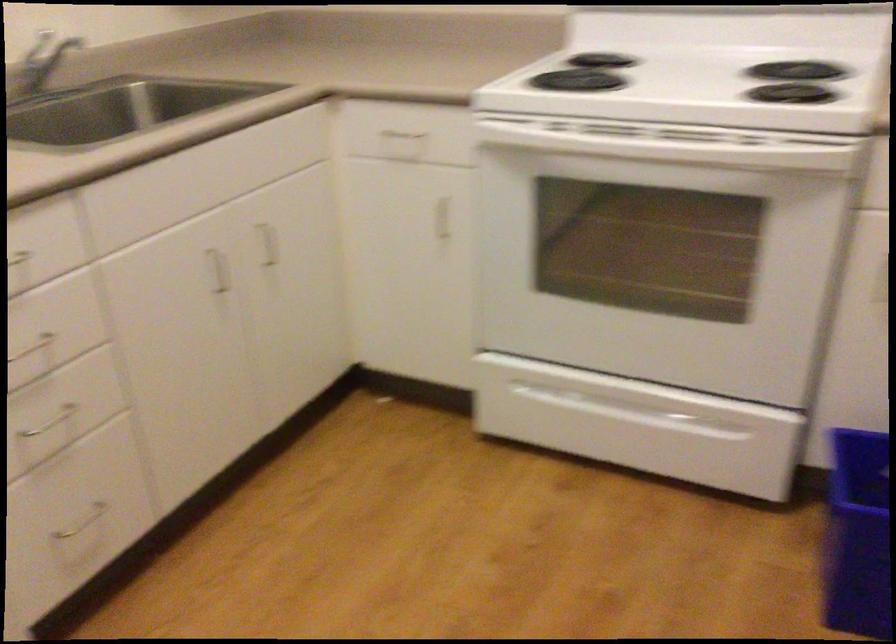
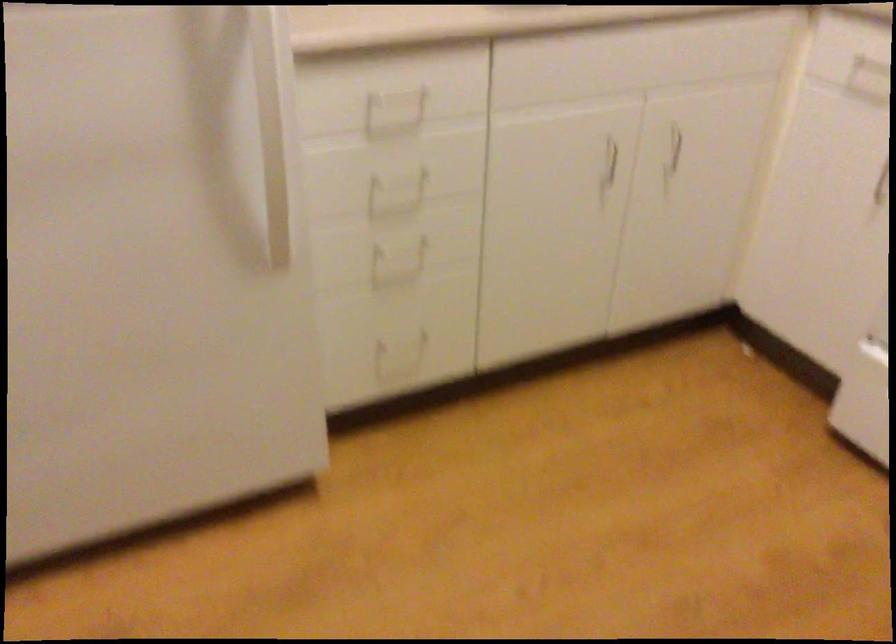
Where in the second image is the point corresponding to point 268,249 from the first image?

(675, 147)